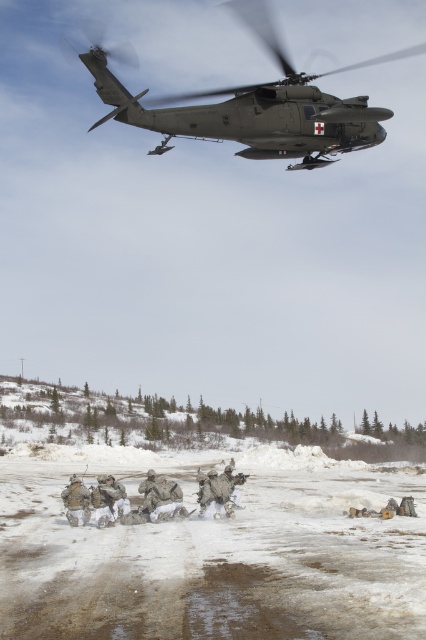
Question: Is matte green helicopter at upper center positioned at the back of camouflage fabric uniform at center?

Choices:
 (A) no
 (B) yes

Answer: (A)

Question: From the image, what is the correct spatial relationship of matte green helicopter at upper center in relation to camouflage fabric uniform at center?

Choices:
 (A) below
 (B) above

Answer: (B)

Question: Which of the following is the farthest from the observer?

Choices:
 (A) camouflage fabric uniform at center
 (B) matte green helicopter at upper center

Answer: (A)

Question: Is matte green helicopter at upper center smaller than camouflage fabric uniform at center?

Choices:
 (A) no
 (B) yes

Answer: (A)

Question: Which point is closer to the camera?

Choices:
 (A) matte green helicopter at upper center
 (B) camouflage fabric uniform at center

Answer: (A)